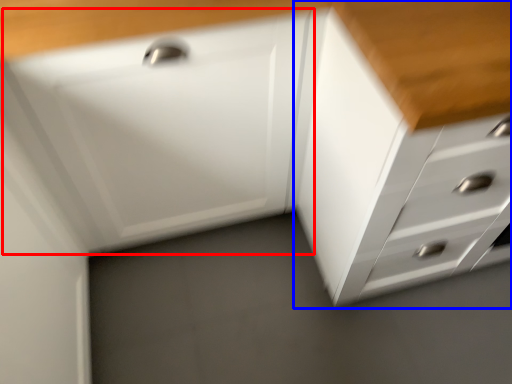
Question: Which object appears farthest to the camera in this image, drawer (highlighted by a red box) or chest of drawers (highlighted by a blue box)?

Choices:
 (A) drawer
 (B) chest of drawers

Answer: (A)